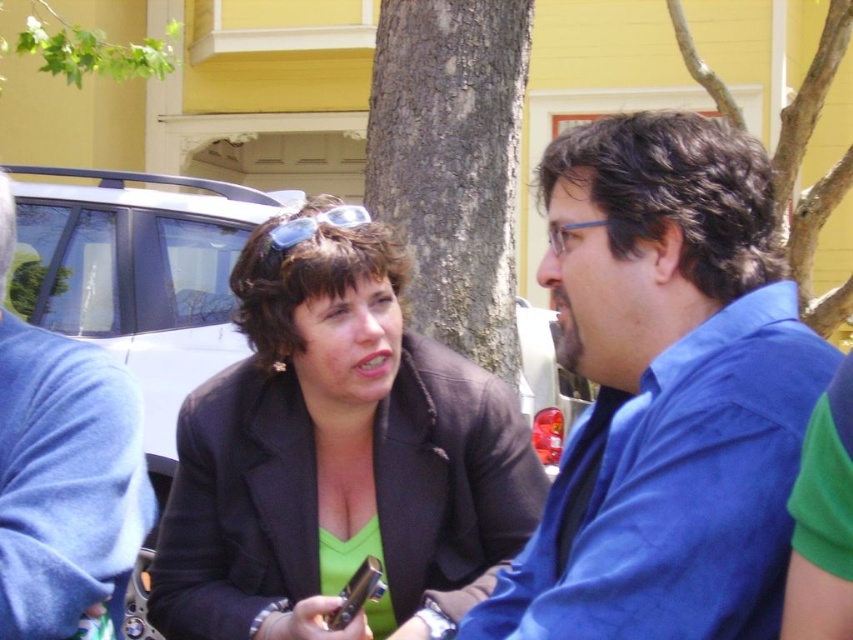
You are a photographer taking a picture of the blue cotton shirt at center and the green leafy branch at upper left. Which object should you focus on first if you want to capture both in sharp focus?

The blue cotton shirt at center is located below the green leafy branch at upper left, so you should focus on the green leafy branch at upper left first to ensure both are in sharp focus.

Based on the scene description, if you were standing at the same level as the brown textured tree trunk at center, would the matte black blazer at center be visible to you?

The matte black blazer at center is located below the brown textured tree trunk at center, so if you were standing at the same level as the tree trunk, the blazer would be blocked from view by the tree trunk and thus not visible.